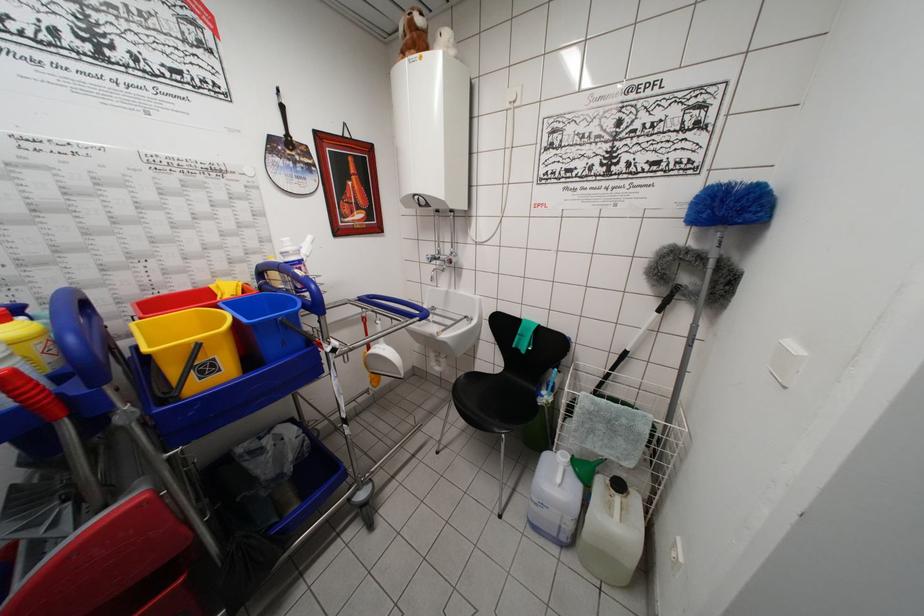
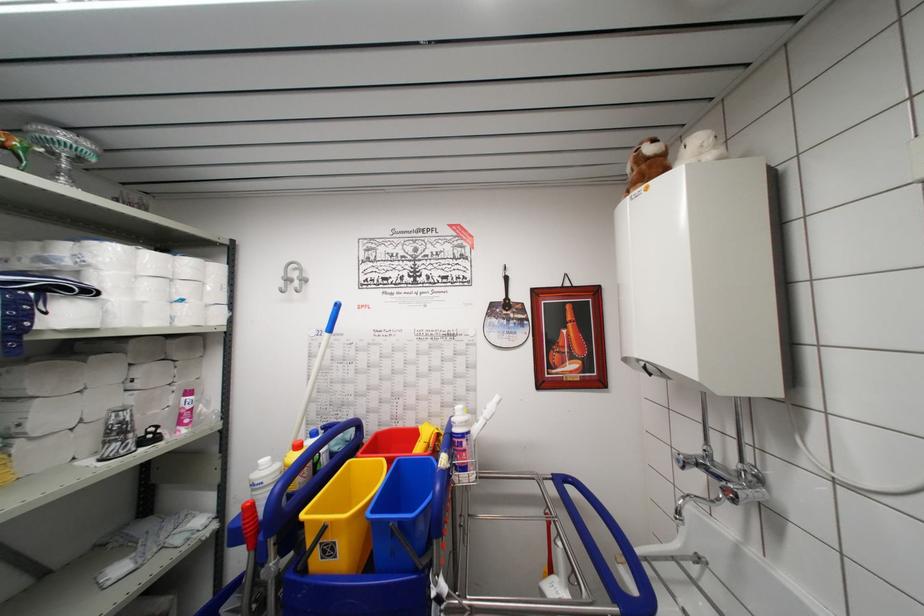
Locate, in the second image, the point that corresponds to (435,283) in the first image.

(681, 517)